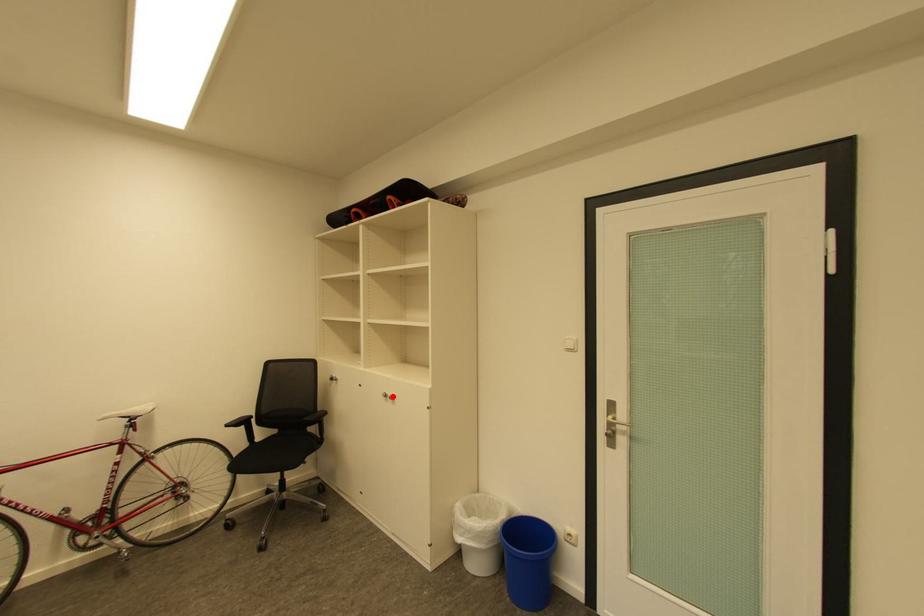
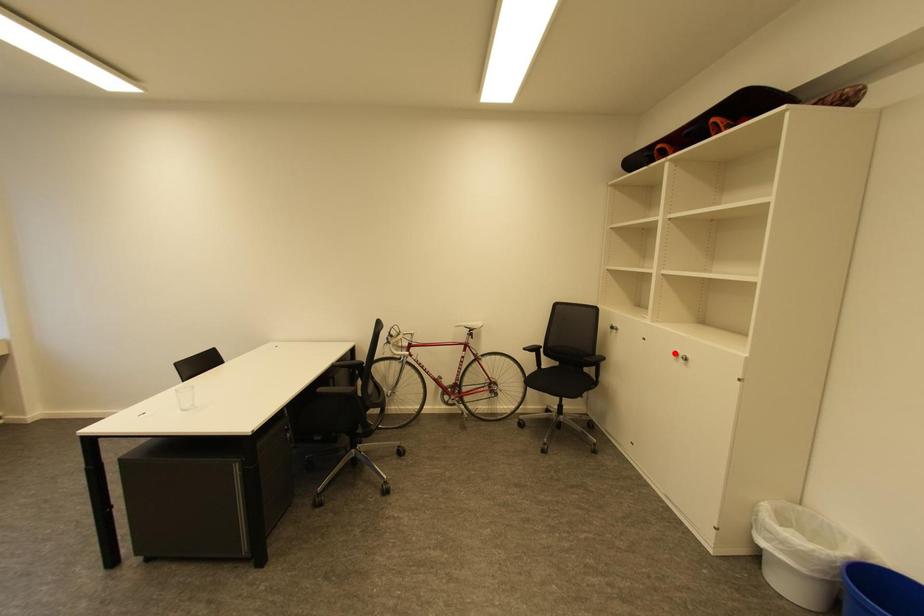
I am providing you with two images of the same scene from different viewpoints. A red point is marked on the first image and another point is marked on the second image. Does the point marked in image1 correspond to the same location as the one in image2?

No